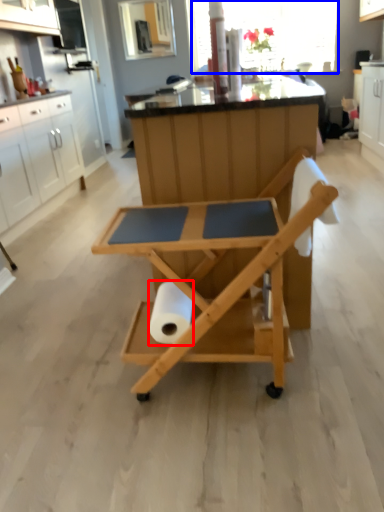
Question: Which object is further to the camera taking this photo, paper towel (highlighted by a red box) or window screen (highlighted by a blue box)?

Choices:
 (A) paper towel
 (B) window screen

Answer: (B)